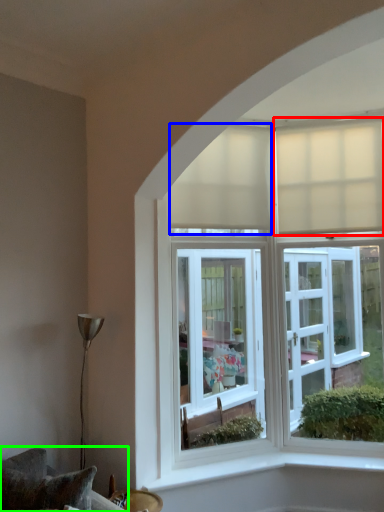
Question: Estimate the real-world distances between objects in this image. Which object is farther from curtain (highlighted by a red box), curtain (highlighted by a blue box) or furniture (highlighted by a green box)?

Choices:
 (A) curtain
 (B) furniture

Answer: (B)